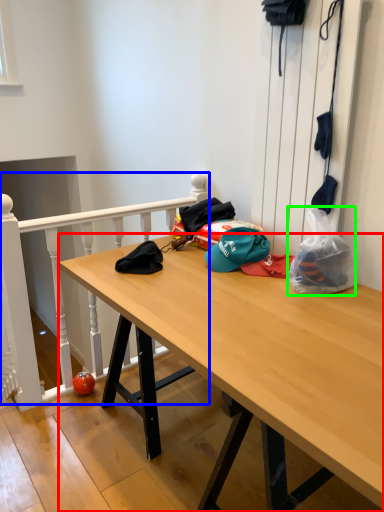
Question: Which is nearer to the desk (highlighted by a red box)? rail (highlighted by a blue box) or plastic bag (highlighted by a green box).

Choices:
 (A) rail
 (B) plastic bag

Answer: (B)